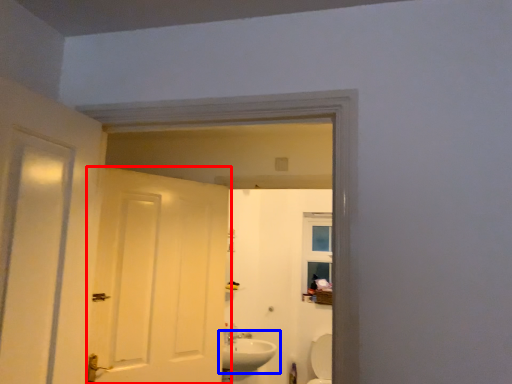
Question: Among these objects, which one is farthest to the camera, door (highlighted by a red box) or sink (highlighted by a blue box)?

Choices:
 (A) door
 (B) sink

Answer: (B)